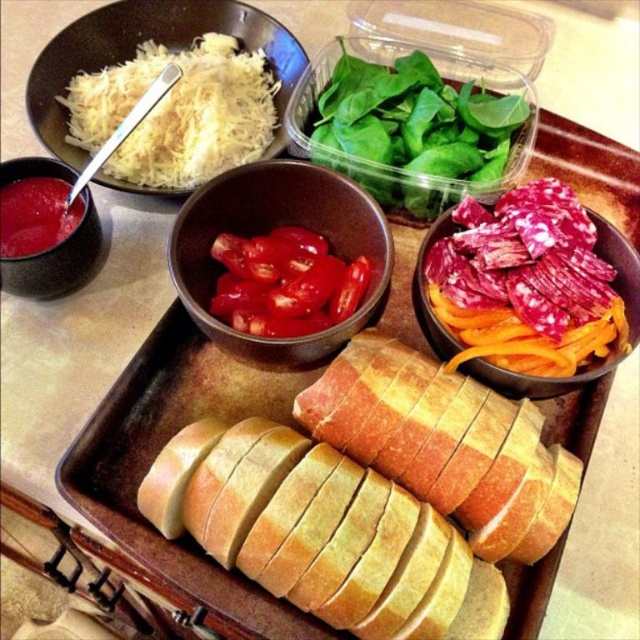
Question: Estimate the real-world distances between objects in this image. Which object is closer to the matte red sauce at upper left?

Choices:
 (A) white matte shredded cheese at upper left
 (B) golden brown crusty bread at center
 (C) green leafy spinach at upper center

Answer: (A)

Question: Does sliced tomatoes in matte bowl at center appear on the left side of matte red sauce at upper left?

Choices:
 (A) no
 (B) yes

Answer: (A)

Question: Is sliced salami at center smaller than matte red sauce at upper left?

Choices:
 (A) no
 (B) yes

Answer: (A)

Question: Is sliced tomatoes in matte bowl at center further to camera compared to matte red sauce at upper left?

Choices:
 (A) no
 (B) yes

Answer: (A)

Question: Which of these objects is positioned farthest from the golden brown crusty bread at center?

Choices:
 (A) matte black bowl at upper left
 (B) white matte shredded cheese at upper left
 (C) matte red sauce at upper left
 (D) bright red tomato at center

Answer: (C)

Question: Which of the following is the farthest from the observer?

Choices:
 (A) (625, 266)
 (B) (269, 564)
 (C) (36, 204)
 (D) (353, 260)

Answer: (D)